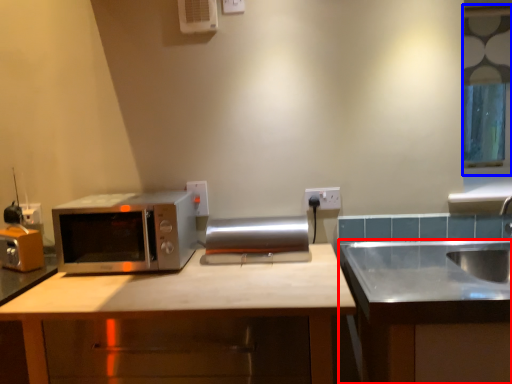
Question: Which point is further to the camera, cabinetry (highlighted by a red box) or window (highlighted by a blue box)?

Choices:
 (A) cabinetry
 (B) window

Answer: (B)